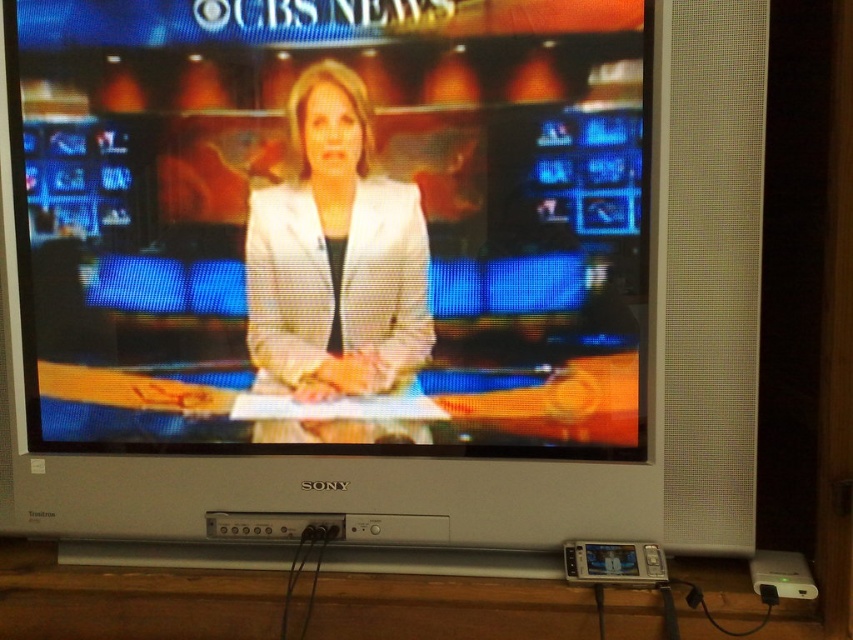
Question: Is matte white suit at center closer to the viewer compared to white matte blazer at center?

Choices:
 (A) yes
 (B) no

Answer: (A)

Question: Which object is closer to the camera taking this photo?

Choices:
 (A) white matte blazer at center
 (B) matte white suit at center

Answer: (B)

Question: In this image, where is matte white suit at center located relative to white matte blazer at center?

Choices:
 (A) above
 (B) below

Answer: (A)

Question: Does matte white suit at center appear over white matte blazer at center?

Choices:
 (A) no
 (B) yes

Answer: (B)

Question: Among these points, which one is farthest from the camera?

Choices:
 (A) (305, 253)
 (B) (248, 374)

Answer: (B)

Question: Which point appears farthest from the camera in this image?

Choices:
 (A) (349, 100)
 (B) (595, 248)

Answer: (A)